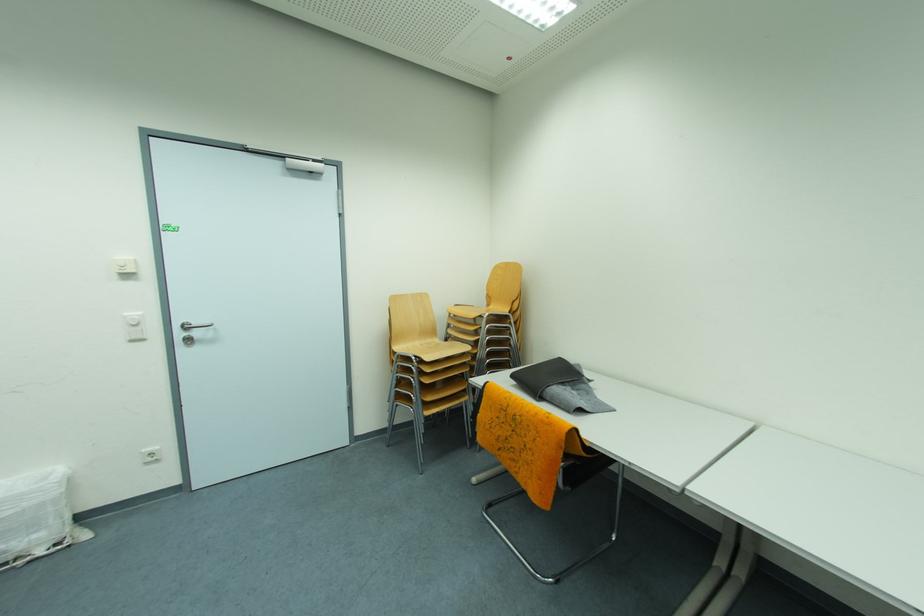
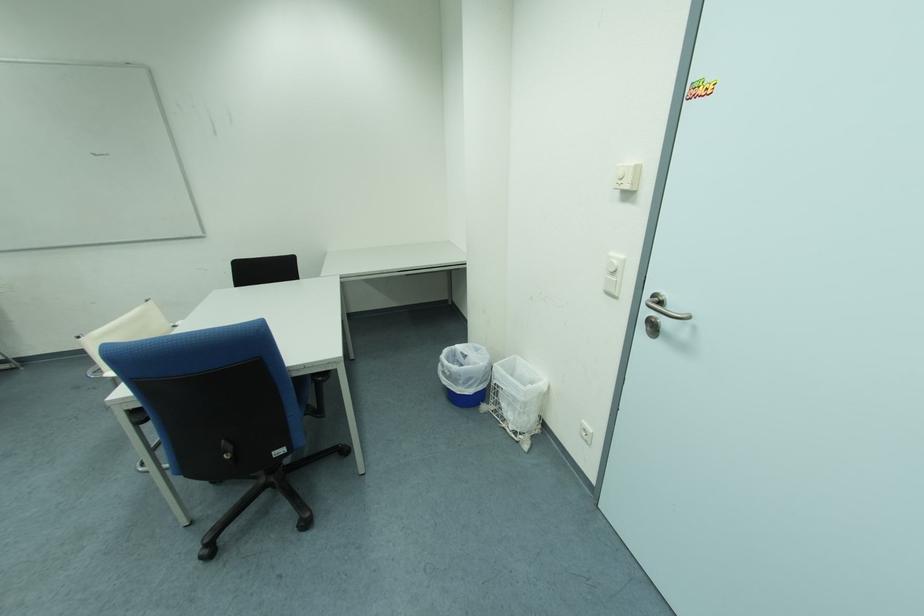
Locate, in the second image, the point that corresponds to pixel 131 270 in the first image.

(628, 185)